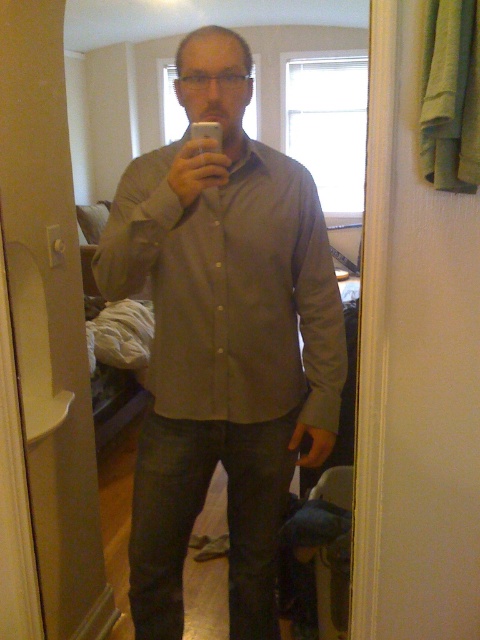
Who is more forward, (225,349) or (120,148)?

Point (225,349) is in front.

In the scene shown: Does matte brown shirt at center have a lesser width compared to matte gray shirt at center?

No, matte brown shirt at center is not thinner than matte gray shirt at center.

Between point (285, 344) and point (241, 364), which one is positioned behind?

Point (285, 344)

Find the location of a particular element. The image size is (480, 640). matte brown shirt at center is located at coordinates (230, 289).